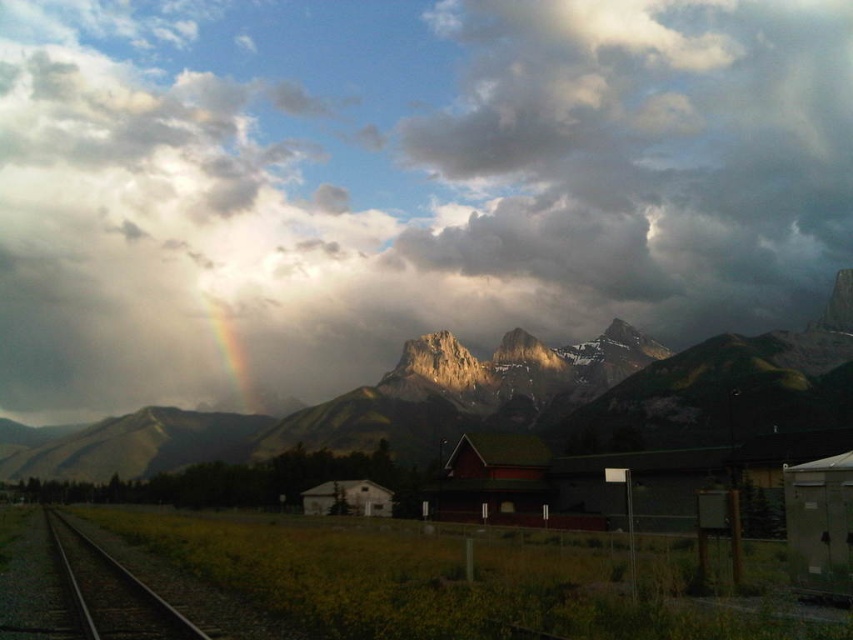
You are a GUI agent. You are given a task and a screenshot of the screen. Output one action in this format:
    pyautogui.click(x=<x>, y=<y>)
    Task: Click on the rugged granite mountains at center
    This screenshot has width=853, height=640.
    Given the screenshot: What is the action you would take?
    pyautogui.click(x=483, y=403)

You are a GUI agent. You are given a task and a screenshot of the screen. Output one action in this format:
    pyautogui.click(x=<x>, y=<y>)
    Task: Click on the rugged granite mountains at center
    The height and width of the screenshot is (640, 853).
    Given the screenshot: What is the action you would take?
    pyautogui.click(x=483, y=403)

Which of these two, cloudy sky at upper center or rugged granite mountains at center, stands taller?

Standing taller between the two is cloudy sky at upper center.

Image resolution: width=853 pixels, height=640 pixels. What do you see at coordinates (401, 180) in the screenshot?
I see `cloudy sky at upper center` at bounding box center [401, 180].

Is point (51, 376) more distant than point (368, 440)?

Yes.

This screenshot has width=853, height=640. Find the location of `cloudy sky at upper center`. cloudy sky at upper center is located at coordinates coord(401,180).

Who is higher up, cloudy sky at upper center or rainbow translucent at center?

cloudy sky at upper center

Who is lower down, cloudy sky at upper center or rainbow translucent at center?

Positioned lower is rainbow translucent at center.

Between point (492, 17) and point (206, 296), which one is positioned in front?

Positioned in front is point (206, 296).

Locate an element on the screen. This screenshot has width=853, height=640. cloudy sky at upper center is located at coordinates (401, 180).